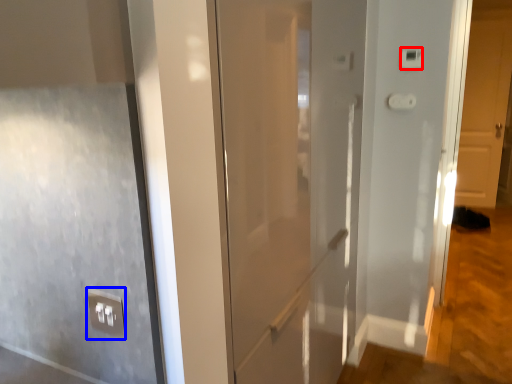
Question: Which point is closer to the camera, light switch (highlighted by a red box) or electric outlet (highlighted by a blue box)?

Choices:
 (A) light switch
 (B) electric outlet

Answer: (B)